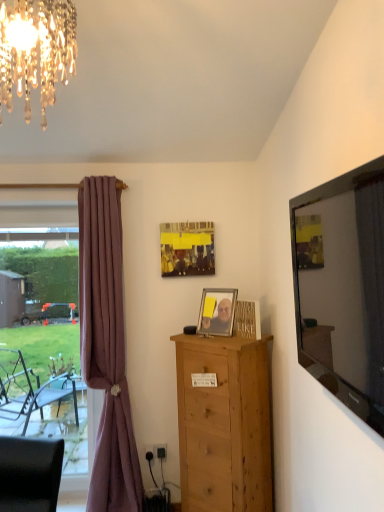
Question: Would you say clear glass window at left is a long distance from matte yellow picture frame at center, the 1th picture frame in the back-to-front sequence?

Choices:
 (A) no
 (B) yes

Answer: (B)

Question: Can you confirm if clear glass window at left is shorter than matte yellow picture frame at center, the 1th picture frame positioned from the top?

Choices:
 (A) no
 (B) yes

Answer: (A)

Question: Is clear glass window at left thinner than matte yellow picture frame at center, the 1th picture frame positioned from the top?

Choices:
 (A) yes
 (B) no

Answer: (B)

Question: Does clear glass window at left contain matte yellow picture frame at center, which is the 2th picture frame from front to back?

Choices:
 (A) yes
 (B) no

Answer: (B)

Question: Considering the relative positions of clear glass window at left and matte yellow picture frame at center, the 1th picture frame positioned from the top, in the image provided, is clear glass window at left to the left of matte yellow picture frame at center, the 1th picture frame positioned from the top, from the viewer's perspective?

Choices:
 (A) no
 (B) yes

Answer: (B)

Question: Is clear glass window at left to the right of matte yellow picture frame at center, which is the 2th picture frame from front to back, from the viewer's perspective?

Choices:
 (A) no
 (B) yes

Answer: (A)

Question: Can you confirm if natural wood chest of drawers at center is bigger than flat glass mirror at right?

Choices:
 (A) no
 (B) yes

Answer: (B)

Question: Does natural wood chest of drawers at center have a lesser height compared to flat glass mirror at right?

Choices:
 (A) no
 (B) yes

Answer: (A)

Question: From the image's perspective, is natural wood chest of drawers at center on top of flat glass mirror at right?

Choices:
 (A) yes
 (B) no

Answer: (B)

Question: Considering the relative sizes of natural wood chest of drawers at center and flat glass mirror at right in the image provided, is natural wood chest of drawers at center thinner than flat glass mirror at right?

Choices:
 (A) no
 (B) yes

Answer: (A)

Question: Is the surface of natural wood chest of drawers at center in direct contact with flat glass mirror at right?

Choices:
 (A) yes
 (B) no

Answer: (B)

Question: From a real-world perspective, is natural wood chest of drawers at center physically below flat glass mirror at right?

Choices:
 (A) yes
 (B) no

Answer: (A)

Question: Is crystal glass chandelier at upper left smaller than metallic silver picture frame at center, acting as the first picture frame starting from the bottom?

Choices:
 (A) yes
 (B) no

Answer: (B)